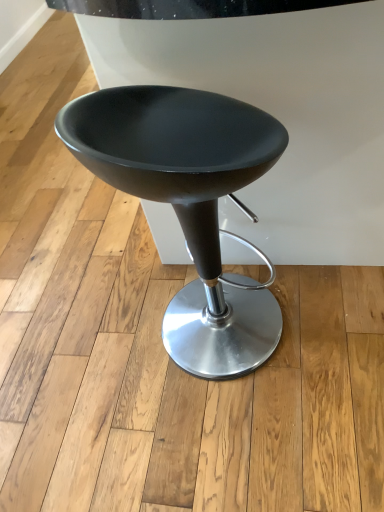
Locate an element on the screen. matte black stool at center is located at coordinates (190, 205).

In order to face matte black stool at center, should I rotate leftwards or rightwards?

A 0.608 degree turn to the right will do.

The width and height of the screenshot is (384, 512). What do you see at coordinates (190, 205) in the screenshot?
I see `matte black stool at center` at bounding box center [190, 205].

You are a GUI agent. You are given a task and a screenshot of the screen. Output one action in this format:
    pyautogui.click(x=<x>, y=<y>)
    Task: Click on the matte black stool at center
    The height and width of the screenshot is (512, 384).
    Given the screenshot: What is the action you would take?
    pyautogui.click(x=190, y=205)